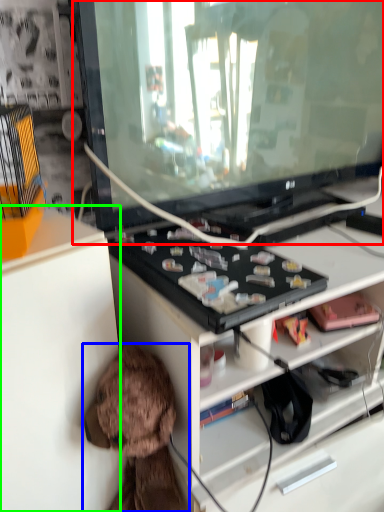
Question: Which object is the farthest from television (highlighted by a red box)? Choose among these: toy (highlighted by a blue box) or cabinetry (highlighted by a green box).

Choices:
 (A) toy
 (B) cabinetry

Answer: (A)